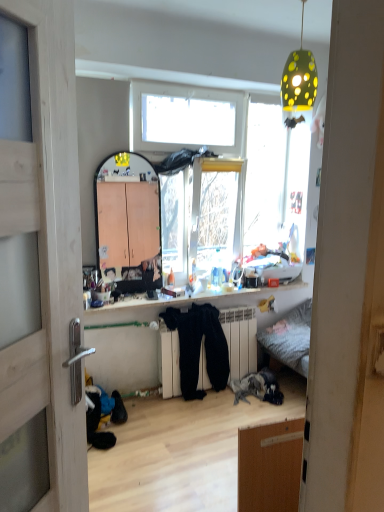
Image resolution: width=384 pixels, height=512 pixels. I want to click on vacant space in front of white matte radiator at center, so click(x=201, y=414).